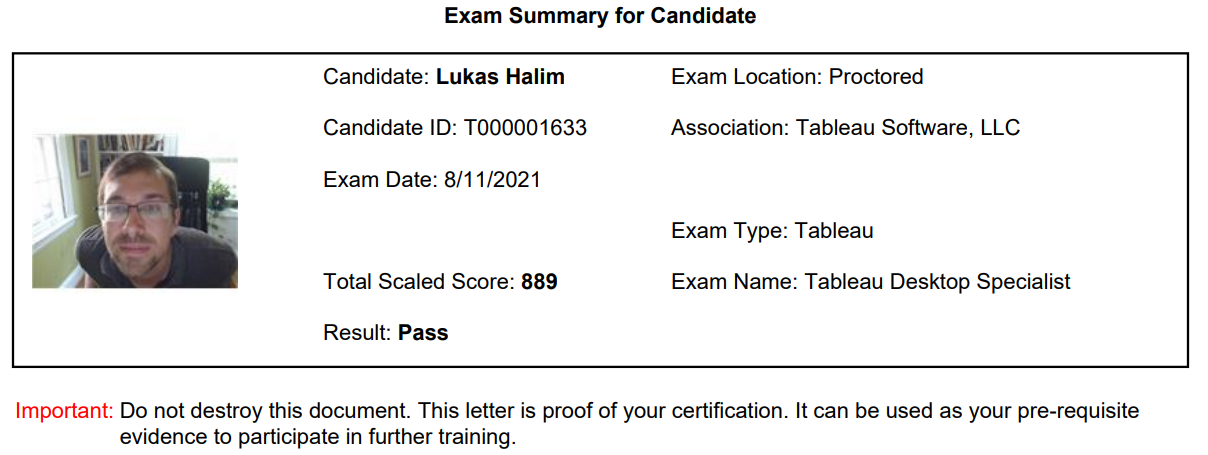
In order to click on chair in this screenshot , I will do `click(180, 176)`.